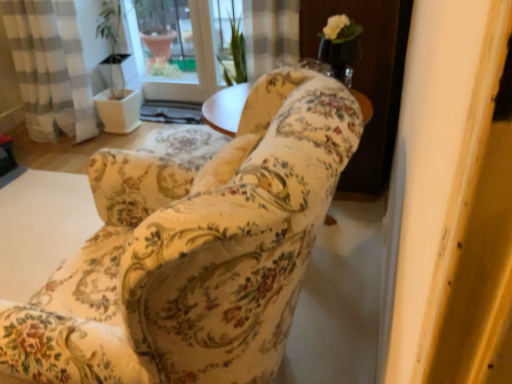
Question: Is white glossy screen door at upper center in front of or behind floral fabric chair at center in the image?

Choices:
 (A) behind
 (B) front

Answer: (A)

Question: In the image, is white glossy screen door at upper center on the left side or the right side of floral fabric chair at center?

Choices:
 (A) left
 (B) right

Answer: (B)

Question: Considering the positions of white glossy screen door at upper center and floral fabric chair at center in the image, is white glossy screen door at upper center bigger or smaller than floral fabric chair at center?

Choices:
 (A) big
 (B) small

Answer: (B)

Question: Is floral fabric chair at center taller or shorter than white glossy screen door at upper center?

Choices:
 (A) tall
 (B) short

Answer: (A)

Question: From the image's perspective, relative to white glossy screen door at upper center, is floral fabric chair at center above or below?

Choices:
 (A) below
 (B) above

Answer: (A)

Question: Which is correct: floral fabric chair at center is inside white glossy screen door at upper center, or outside of it?

Choices:
 (A) inside
 (B) outside

Answer: (B)

Question: Based on their sizes in the image, would you say floral fabric chair at center is bigger or smaller than white glossy screen door at upper center?

Choices:
 (A) small
 (B) big

Answer: (B)